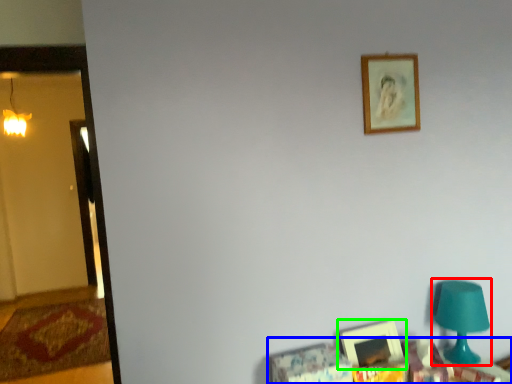
Question: Which is farther away from table lamp (highlighted by a red box)? furniture (highlighted by a blue box) or picture frame (highlighted by a green box)?

Choices:
 (A) furniture
 (B) picture frame

Answer: (B)